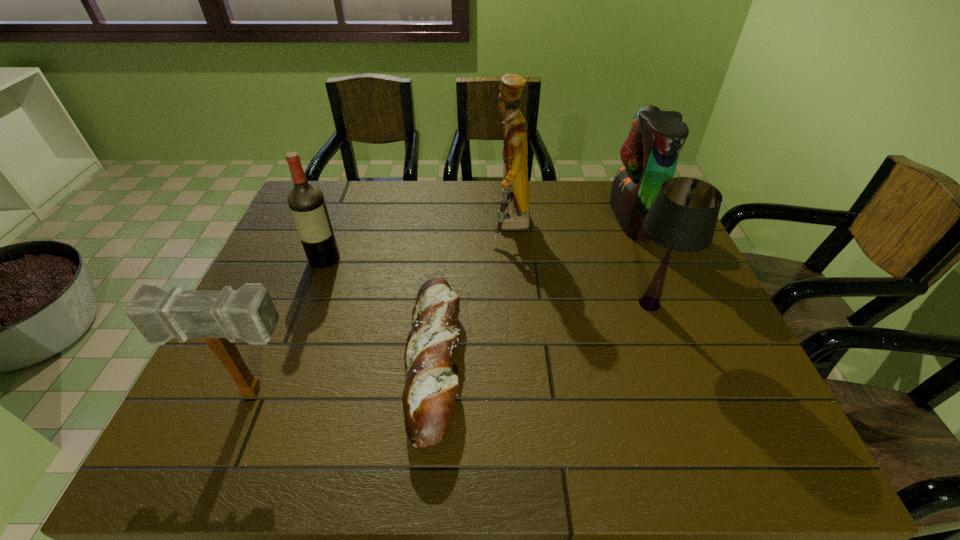
Identify the location of vacant area that lies between the lampshade and the third object from left to right. Image resolution: width=960 pixels, height=540 pixels. (541, 333).

Where is `free space between the mallet and the shortest object`? free space between the mallet and the shortest object is located at coordinates (345, 376).

I want to click on object that can be found as the third closest to the nutcracker, so click(x=650, y=153).

This screenshot has height=540, width=960. Find the location of `object that stands as the fourth closest to the fourth nearest object`. object that stands as the fourth closest to the fourth nearest object is located at coordinates (683, 217).

The image size is (960, 540). I want to click on free spot that satisfies the following two spatial constraints: 1. on the front-facing side of the nutcracker; 2. on the front-facing side of the third farthest object, so click(514, 259).

Where is `free location that satisfies the following two spatial constraints: 1. on the front-facing side of the tallest object; 2. on the front-facing side of the liquor`? free location that satisfies the following two spatial constraints: 1. on the front-facing side of the tallest object; 2. on the front-facing side of the liquor is located at coordinates click(x=514, y=259).

You are a GUI agent. You are given a task and a screenshot of the screen. Output one action in this format:
    pyautogui.click(x=<x>, y=<y>)
    Task: Click on the vacant area that satisfies the following two spatial constraints: 1. on the front-facing side of the fourth object from left to right; 2. on the front-facing side of the liquor
    The height and width of the screenshot is (540, 960).
    Given the screenshot: What is the action you would take?
    pyautogui.click(x=514, y=259)

Where is `free space in the image that satisfies the following two spatial constraints: 1. at the face of the parrot; 2. on the front side of the mallet`? free space in the image that satisfies the following two spatial constraints: 1. at the face of the parrot; 2. on the front side of the mallet is located at coordinates (703, 392).

The width and height of the screenshot is (960, 540). Identify the location of free space in the image that satisfies the following two spatial constraints: 1. on the front-facing side of the tallest object; 2. on the front-facing side of the liquor. (514, 259).